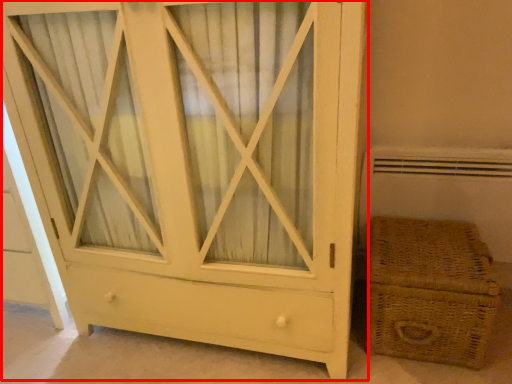
Question: From the image, what is the correct spatial relationship of chest of drawers (annotated by the red box) in relation to basket?

Choices:
 (A) right
 (B) left

Answer: (B)